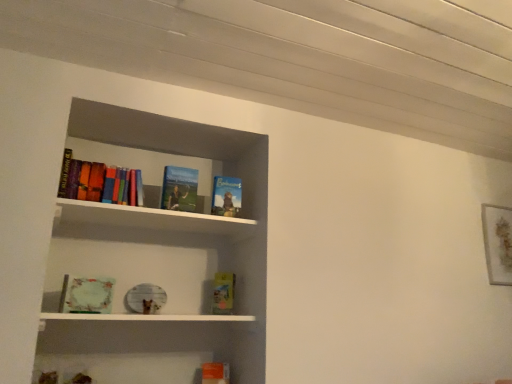
Where is `vacant area situated below multicolored hardcover books at upper left, the sixth book ordered from the bottom (from a real-world perspective)`? vacant area situated below multicolored hardcover books at upper left, the sixth book ordered from the bottom (from a real-world perspective) is located at coordinates (110, 206).